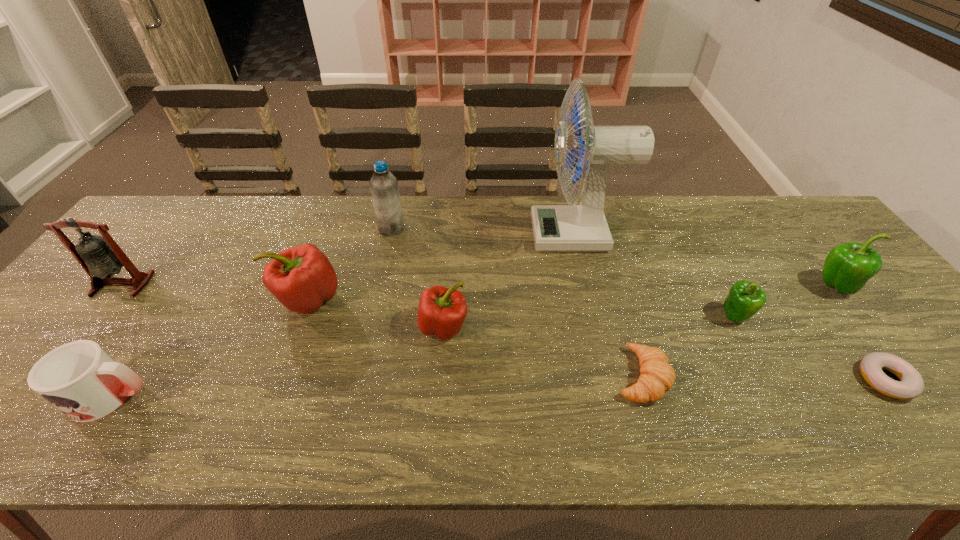
This screenshot has height=540, width=960. In order to click on water bottle at the far edge in this screenshot , I will do `click(383, 184)`.

Image resolution: width=960 pixels, height=540 pixels. What are the coordinates of `object that is at the near edge` in the screenshot? It's located at (79, 378).

The height and width of the screenshot is (540, 960). What are the coordinates of `object at the left edge` in the screenshot? It's located at (100, 256).

The image size is (960, 540). I want to click on bell pepper that is at the right edge, so click(x=848, y=267).

Identify the location of doughnut that is at the right edge. Image resolution: width=960 pixels, height=540 pixels. (910, 385).

Identify the location of free space at the far edge of the desktop. Image resolution: width=960 pixels, height=540 pixels. (696, 208).

Find the location of `free space at the near edge of the desktop`. free space at the near edge of the desktop is located at coordinates (341, 431).

Find the location of a particular element. This screenshot has width=960, height=540. vacant space at the left edge of the desktop is located at coordinates click(138, 257).

In the image, there is a desktop. Where is `vacant space at the far left corner`? The height and width of the screenshot is (540, 960). vacant space at the far left corner is located at coordinates (158, 218).

Where is `free space between the smaller pink bell pepper and the fourth object from left to right`? free space between the smaller pink bell pepper and the fourth object from left to right is located at coordinates (418, 278).